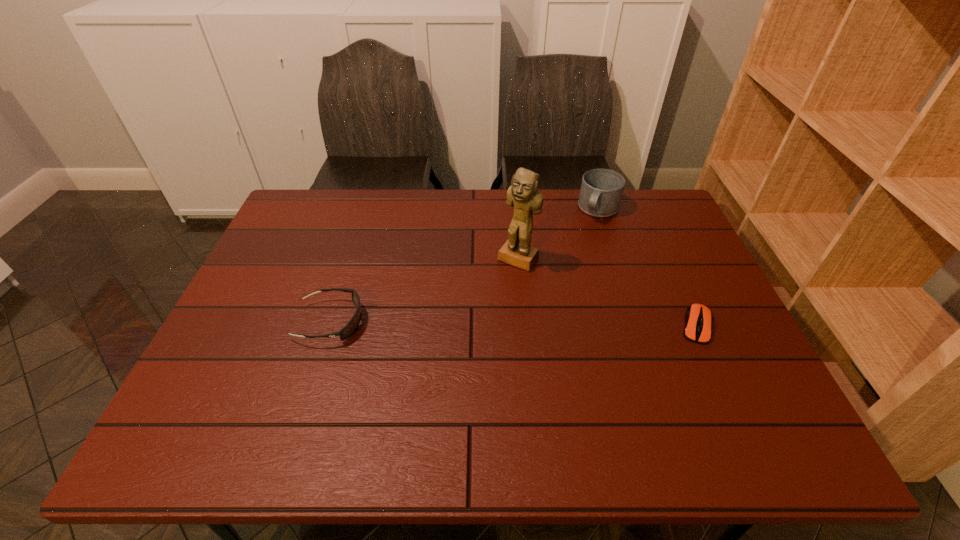
Find the location of `vacant space on the desktop that is between the third tallest object and the computer mouse and is positioned on the side of the mug with the handle`. vacant space on the desktop that is between the third tallest object and the computer mouse and is positioned on the side of the mug with the handle is located at coordinates (537, 324).

Where is `vacant space on the desktop that is between the second shortest object and the computer mouse and is positioned on the front-facing side of the third object from right to left`? The height and width of the screenshot is (540, 960). vacant space on the desktop that is between the second shortest object and the computer mouse and is positioned on the front-facing side of the third object from right to left is located at coordinates (475, 323).